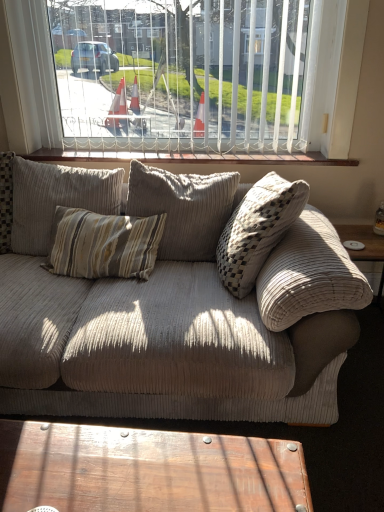
I want to click on beige corduroy pillow at center, which ranks as the first pillow in left-to-right order, so click(56, 199).

The image size is (384, 512). What do you see at coordinates (190, 157) in the screenshot? I see `wooden at upper center` at bounding box center [190, 157].

Find the location of a particular element. Image resolution: width=384 pixels, height=512 pixels. beige corduroy couch at center is located at coordinates (172, 327).

The image size is (384, 512). I want to click on wooden polished coffee table at lower center, so click(x=146, y=470).

Measure the distance between wooden polished coffee table at lower center and camera.

The depth of wooden polished coffee table at lower center is 38.50 inches.

Locate an element on the screen. This screenshot has height=512, width=384. white vertical blinds at upper center is located at coordinates (191, 75).

Is corduroy pillow at center, marked as the 2th pillow in a left-to-right arrangement, not inside wooden polished coffee table at lower center?

Yes, corduroy pillow at center, marked as the 2th pillow in a left-to-right arrangement, is located beyond the bounds of wooden polished coffee table at lower center.

From the image's perspective, is corduroy pillow at center, marked as the 2th pillow in a left-to-right arrangement, positioned above or below wooden polished coffee table at lower center?

corduroy pillow at center, marked as the 2th pillow in a left-to-right arrangement, is above wooden polished coffee table at lower center.

Is corduroy pillow at center, marked as the 2th pillow in a left-to-right arrangement, further to the viewer compared to wooden polished coffee table at lower center?

Yes, it is behind wooden polished coffee table at lower center.

Who is shorter, white vertical blinds at upper center or corduroy pillow at center, the first pillow positioned from the right?

corduroy pillow at center, the first pillow positioned from the right, is shorter.

Between white vertical blinds at upper center and corduroy pillow at center, marked as the 2th pillow in a left-to-right arrangement, which one is positioned in front?

Positioned in front is corduroy pillow at center, marked as the 2th pillow in a left-to-right arrangement.

Is white vertical blinds at upper center next to corduroy pillow at center, the first pillow positioned from the right?

white vertical blinds at upper center is not next to corduroy pillow at center, the first pillow positioned from the right, and they're not touching.

Is white vertical blinds at upper center to the left of corduroy pillow at center, marked as the 2th pillow in a left-to-right arrangement, from the viewer's perspective?

Yes.

Which is more to the right, wooden polished coffee table at lower center or white vertical blinds at upper center?

Positioned to the right is white vertical blinds at upper center.

Is wooden polished coffee table at lower center turned away from white vertical blinds at upper center?

wooden polished coffee table at lower center is not turned away from white vertical blinds at upper center.

From the image's perspective, which is above, wooden polished coffee table at lower center or white vertical blinds at upper center?

From the image's view, white vertical blinds at upper center is above.

Between wooden polished coffee table at lower center and white vertical blinds at upper center, which one is positioned behind?

white vertical blinds at upper center is further away from the camera.

Is point (38, 105) closer to camera compared to point (36, 255)?

No, (38, 105) is behind (36, 255).

Is white vertical blinds at upper center inside or outside of beige corduroy pillow at center, which ranks as the first pillow in left-to-right order?

white vertical blinds at upper center lies outside beige corduroy pillow at center, which ranks as the first pillow in left-to-right order.

At what (x,y) coordinates should I click in order to perform the action: click on window behind the beige corduroy pillow at center, marked as the 2th pillow in a right-to-left arrangement. Please return your answer as a coordinate pair (x, y). Looking at the image, I should click on (191, 75).

From a real-world perspective, which object rests below the other?

corduroy pillow at center, the first pillow positioned from the right, from a real-world perspective.

Could you tell me if wooden at upper center is turned towards corduroy pillow at center, the first pillow positioned from the right?

Yes, wooden at upper center faces towards corduroy pillow at center, the first pillow positioned from the right.

From the image's perspective, between wooden at upper center and corduroy pillow at center, the first pillow positioned from the right, who is located below?

corduroy pillow at center, the first pillow positioned from the right, is shown below in the image.

From a real-world perspective, is wooden polished coffee table at lower center physically below beige corduroy couch at center?

Yes, from a real-world perspective, wooden polished coffee table at lower center is under beige corduroy couch at center.

Between wooden polished coffee table at lower center and beige corduroy couch at center, which one appears on the right side from the viewer's perspective?

From the viewer's perspective, wooden polished coffee table at lower center appears more on the right side.

I want to click on coffee table located behind the beige corduroy couch at center, so click(146, 470).

Locate an element on the screen. coffee table that is in front of the corduroy pillow at center, marked as the 2th pillow in a left-to-right arrangement is located at coordinates (146, 470).

Is wooden polished coffee table at lower center looking in the opposite direction of corduroy pillow at center, the first pillow positioned from the right?

Yes, corduroy pillow at center, the first pillow positioned from the right, is at the back of wooden polished coffee table at lower center.

Is wooden polished coffee table at lower center taller or shorter than corduroy pillow at center, the first pillow positioned from the right?

Considering their sizes, wooden polished coffee table at lower center has less height than corduroy pillow at center, the first pillow positioned from the right.

Which of these two, wooden polished coffee table at lower center or corduroy pillow at center, marked as the 2th pillow in a left-to-right arrangement, is wider?

With larger width is corduroy pillow at center, marked as the 2th pillow in a left-to-right arrangement.

Find the location of a particular element. The width and height of the screenshot is (384, 512). coffee table located underneath the corduroy pillow at center, marked as the 2th pillow in a left-to-right arrangement (from a real-world perspective) is located at coordinates (x=146, y=470).

Find the location of `window above the corduroy pillow at center, the first pillow positioned from the right (from the image's perspective)`. window above the corduroy pillow at center, the first pillow positioned from the right (from the image's perspective) is located at coordinates (191, 75).

In the scene shown: Which object lies nearer to the anchor point beige corduroy pillow at center, which ranks as the first pillow in left-to-right order, wooden at upper center or wooden polished coffee table at lower center?

wooden at upper center is positioned closer to the anchor beige corduroy pillow at center, which ranks as the first pillow in left-to-right order.

From the image, which object appears to be nearer to beige corduroy pillow at center, marked as the 2th pillow in a right-to-left arrangement, wooden polished coffee table at lower center or white vertical blinds at upper center?

Among the two, white vertical blinds at upper center is located nearer to beige corduroy pillow at center, marked as the 2th pillow in a right-to-left arrangement.

Estimate the real-world distances between objects in this image. Which object is closer to corduroy pillow at center, the first pillow positioned from the right, wooden polished coffee table at lower center or wooden at upper center?

wooden at upper center is closer to corduroy pillow at center, the first pillow positioned from the right.

Considering their positions, is wooden polished coffee table at lower center positioned closer to beige corduroy pillow at center, marked as the 2th pillow in a right-to-left arrangement, than beige corduroy couch at center?

Among the two, beige corduroy couch at center is located nearer to beige corduroy pillow at center, marked as the 2th pillow in a right-to-left arrangement.

Considering their positions, is wooden at upper center positioned further to corduroy pillow at center, the first pillow positioned from the right, than beige corduroy pillow at center, which ranks as the first pillow in left-to-right order?

Based on the image, wooden at upper center appears to be further to corduroy pillow at center, the first pillow positioned from the right.

Consider the image. When comparing their distances from beige corduroy couch at center, does corduroy pillow at center, marked as the 2th pillow in a left-to-right arrangement, or white vertical blinds at upper center seem further?

The object further to beige corduroy couch at center is white vertical blinds at upper center.

Based on their spatial positions, is beige corduroy pillow at center, which ranks as the first pillow in left-to-right order, or corduroy pillow at center, marked as the 2th pillow in a left-to-right arrangement, further from wooden at upper center?

corduroy pillow at center, marked as the 2th pillow in a left-to-right arrangement.

Which object lies nearer to the anchor point beige corduroy couch at center, wooden at upper center or corduroy pillow at center, the first pillow positioned from the right?

corduroy pillow at center, the first pillow positioned from the right, is closer to beige corduroy couch at center.

I want to click on pillow between white vertical blinds at upper center and beige corduroy pillow at center, marked as the 2th pillow in a right-to-left arrangement, vertically, so click(x=183, y=209).

Where is `studio couch between white vertical blinds at upper center and wooden polished coffee table at lower center in the up-down direction`? studio couch between white vertical blinds at upper center and wooden polished coffee table at lower center in the up-down direction is located at coordinates (172, 327).

This screenshot has width=384, height=512. In order to click on window sill between white vertical blinds at upper center and beige corduroy pillow at center, which ranks as the first pillow in left-to-right order, in the up-down direction in this screenshot , I will do `click(190, 157)`.

Image resolution: width=384 pixels, height=512 pixels. In order to click on window between beige corduroy couch at center and wooden at upper center in the front-back direction in this screenshot , I will do `click(191, 75)`.